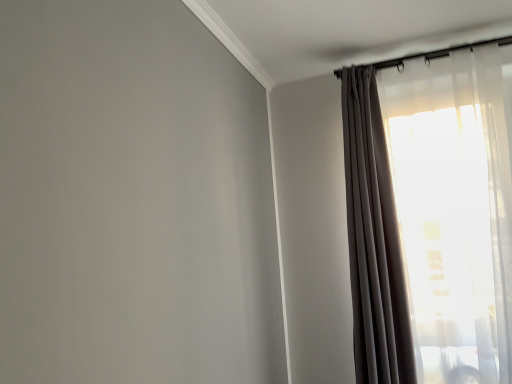
Question: In terms of size, does translucent sheer curtain at upper right, arranged as the second curtain when viewed from the left, appear bigger or smaller than matte gray curtain at upper right, the 2th curtain positioned from the right?

Choices:
 (A) big
 (B) small

Answer: (A)

Question: Considering the positions of translucent sheer curtain at upper right, marked as the 1th curtain in a right-to-left arrangement, and matte gray curtain at upper right, the 2th curtain positioned from the right, in the image, is translucent sheer curtain at upper right, marked as the 1th curtain in a right-to-left arrangement, wider or thinner than matte gray curtain at upper right, the 2th curtain positioned from the right,?

Choices:
 (A) thin
 (B) wide

Answer: (A)

Question: Visually, is translucent sheer curtain at upper right, marked as the 1th curtain in a right-to-left arrangement, positioned to the left or to the right of matte gray curtain at upper right, the 2th curtain positioned from the right?

Choices:
 (A) right
 (B) left

Answer: (A)

Question: Is point (352, 226) positioned closer to the camera than point (445, 246)?

Choices:
 (A) farther
 (B) closer

Answer: (A)

Question: In terms of height, does matte gray curtain at upper right, which is counted as the 1th curtain, starting from the left, look taller or shorter compared to translucent sheer curtain at upper right, marked as the 1th curtain in a right-to-left arrangement?

Choices:
 (A) tall
 (B) short

Answer: (B)

Question: Considering the positions of matte gray curtain at upper right, which is counted as the 1th curtain, starting from the left, and translucent sheer curtain at upper right, marked as the 1th curtain in a right-to-left arrangement, in the image, is matte gray curtain at upper right, which is counted as the 1th curtain, starting from the left, wider or thinner than translucent sheer curtain at upper right, marked as the 1th curtain in a right-to-left arrangement,?

Choices:
 (A) thin
 (B) wide

Answer: (B)

Question: From the image's perspective, is matte gray curtain at upper right, which is counted as the 1th curtain, starting from the left, located above or below translucent sheer curtain at upper right, marked as the 1th curtain in a right-to-left arrangement?

Choices:
 (A) below
 (B) above

Answer: (A)